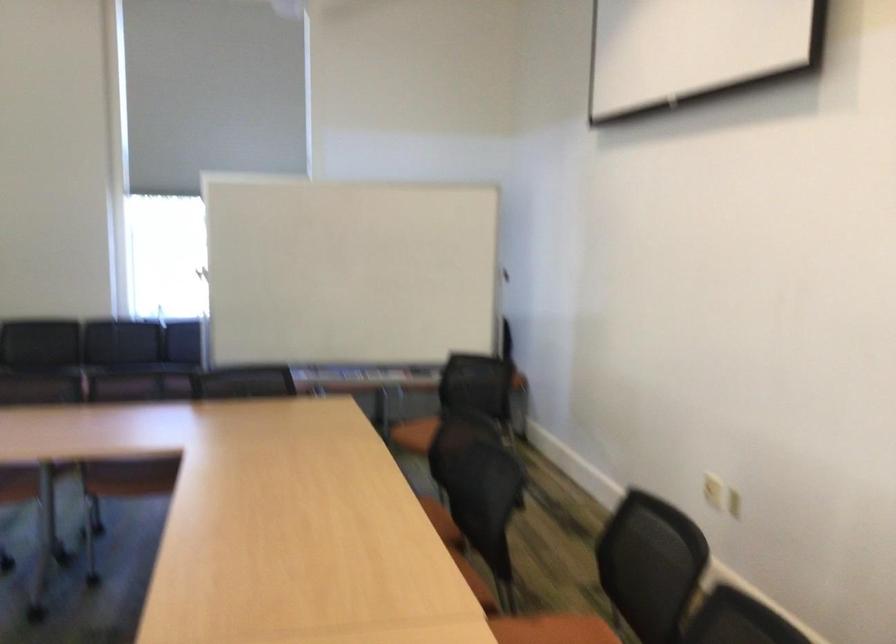
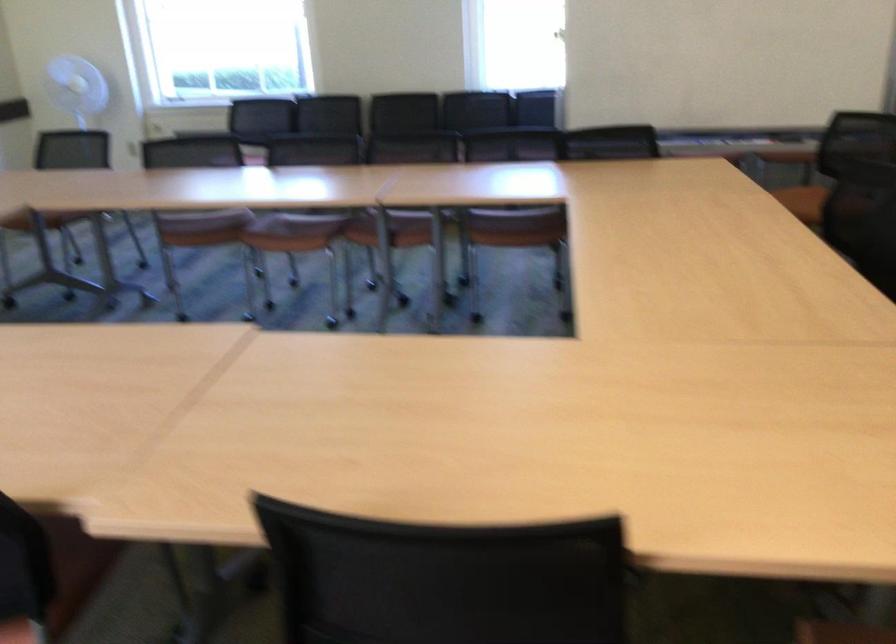
Question: The camera is either moving clockwise (left) or counter-clockwise (right) around the object. The first image is from the beginning of the video and the second image is from the end. Is the camera moving left or right when shooting the video?

Choices:
 (A) Left
 (B) Right

Answer: (B)